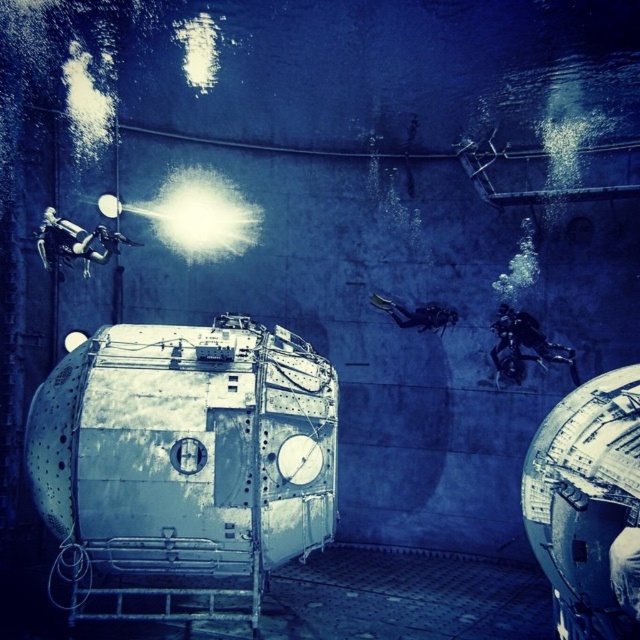
Question: Which object appears farthest from the camera in this image?

Choices:
 (A) metallic industrial tank at center
 (B) shiny silver spacesuit at upper left

Answer: (B)

Question: Does metallic industrial tank at center have a smaller size compared to shiny black spacesuit at right?

Choices:
 (A) yes
 (B) no

Answer: (B)

Question: Which object is farther from the camera taking this photo?

Choices:
 (A) metallic industrial tank at center
 (B) shiny silver spacesuit at upper left
 (C) shiny black spacesuit at right

Answer: (C)

Question: Does metallic industrial tank at center appear under shiny silver spacesuit at upper left?

Choices:
 (A) yes
 (B) no

Answer: (A)

Question: Among these objects, which one is nearest to the camera?

Choices:
 (A) shiny silver spacesuit at upper left
 (B) shiny black spacesuit at right

Answer: (A)

Question: Observing the image, what is the correct spatial positioning of shiny black spacesuit at right in reference to shiny silver spacesuit at upper left?

Choices:
 (A) left
 (B) right

Answer: (B)